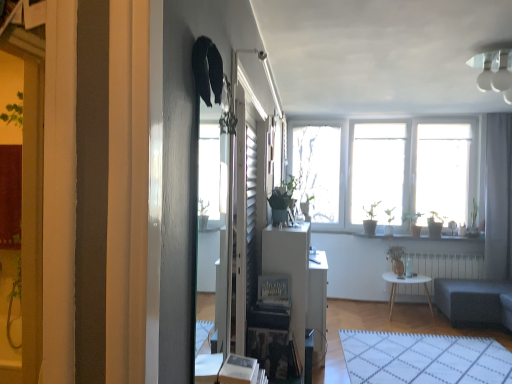
Question: Is white wooden table at center looking in the opposite direction of white glossy table at center?

Choices:
 (A) no
 (B) yes

Answer: (A)

Question: Can you confirm if white wooden table at center is taller than white glossy table at center?

Choices:
 (A) no
 (B) yes

Answer: (A)

Question: Does white wooden table at center have a lesser width compared to white glossy table at center?

Choices:
 (A) no
 (B) yes

Answer: (A)

Question: Would you say white glossy table at center is part of white wooden table at center's contents?

Choices:
 (A) yes
 (B) no

Answer: (B)

Question: Is white wooden table at center bigger than white glossy table at center?

Choices:
 (A) no
 (B) yes

Answer: (B)

Question: From the image's perspective, is white grid rug at lower center positioned above or below white glossy light fixture at upper right?

Choices:
 (A) above
 (B) below

Answer: (B)

Question: Would you say white grid rug at lower center is to the left or to the right of white glossy light fixture at upper right in the picture?

Choices:
 (A) right
 (B) left

Answer: (B)

Question: From their relative heights in the image, would you say white grid rug at lower center is taller or shorter than white glossy light fixture at upper right?

Choices:
 (A) short
 (B) tall

Answer: (A)

Question: Does point (356, 342) appear closer or farther from the camera than point (501, 66)?

Choices:
 (A) farther
 (B) closer

Answer: (A)

Question: Is white wooden table at center inside the boundaries of white glossy table at center, or outside?

Choices:
 (A) outside
 (B) inside

Answer: (A)

Question: In the image, is white wooden table at center on the left side or the right side of white glossy table at center?

Choices:
 (A) left
 (B) right

Answer: (B)

Question: In terms of height, does white wooden table at center look taller or shorter compared to white glossy table at center?

Choices:
 (A) short
 (B) tall

Answer: (A)

Question: From the image's perspective, relative to white glossy table at center, is white wooden table at center above or below?

Choices:
 (A) above
 (B) below

Answer: (B)

Question: Considering the positions of green matte plant at center, which ranks as the 2th houseplant in right-to-left order, and white glossy window sill at center in the image, is green matte plant at center, which ranks as the 2th houseplant in right-to-left order, bigger or smaller than white glossy window sill at center?

Choices:
 (A) small
 (B) big

Answer: (A)

Question: Is green matte plant at center, arranged as the second houseplant when viewed from the back, taller or shorter than white glossy window sill at center?

Choices:
 (A) tall
 (B) short

Answer: (A)